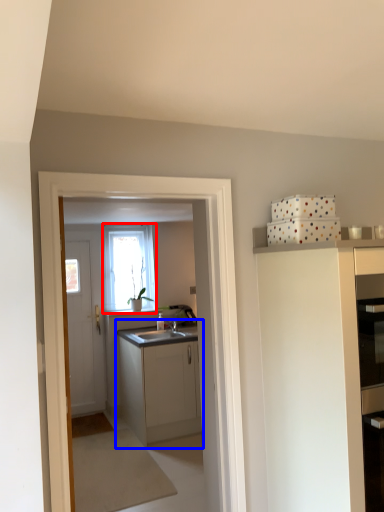
Question: Which object is further to the camera taking this photo, window (highlighted by a red box) or cabinetry (highlighted by a blue box)?

Choices:
 (A) window
 (B) cabinetry

Answer: (A)